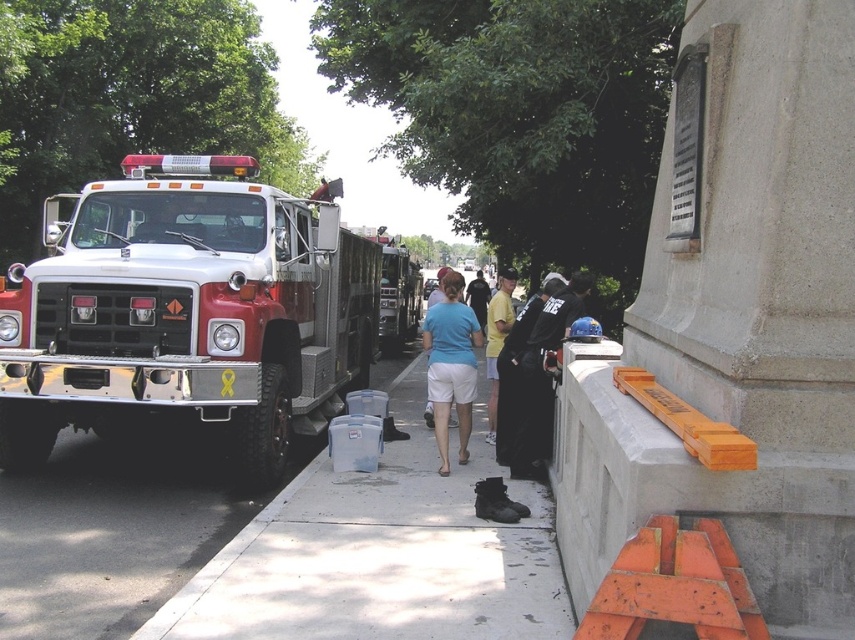
You are standing at the origin point in the image. There are two points marked in the scene. Which point is closer to you, point (198, 173) or point (441, 305)?

Point (441, 305) is closer to you because point (198, 173) is behind it.

In the scene shown: You are a pedestrian standing on the sidewalk and see the red metallic fire truck at left and the black fabric jacket at center. Which object is closer to you?

The red metallic fire truck at left is closer to you because it is positioned over the black fabric jacket at center, meaning it is in front of it from your perspective.

You are organizing a clothing display and need to arrange the blue cotton shirt at center and the yellow cotton shirt at center side by side. Which shirt should you place on the left to ensure they fit within a 1.2 meter wide display stand?

The blue cotton shirt at center has a greater width than the yellow cotton shirt at center. To fit both on the 1.2 meter wide display stand, place the wider blue cotton shirt at center on the left so that the narrower yellow cotton shirt at center can be positioned to its right, utilizing the space efficiently.